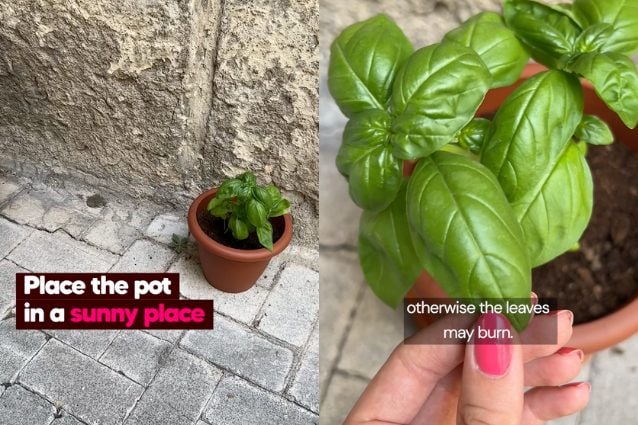
Where is `planter lip`? Image resolution: width=638 pixels, height=425 pixels. planter lip is located at coordinates (244, 253), (621, 325).